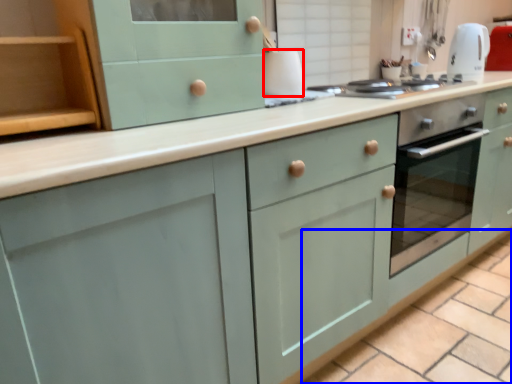
Question: Among these objects, which one is farthest to the camera, appliance (highlighted by a red box) or tile (highlighted by a blue box)?

Choices:
 (A) appliance
 (B) tile

Answer: (A)